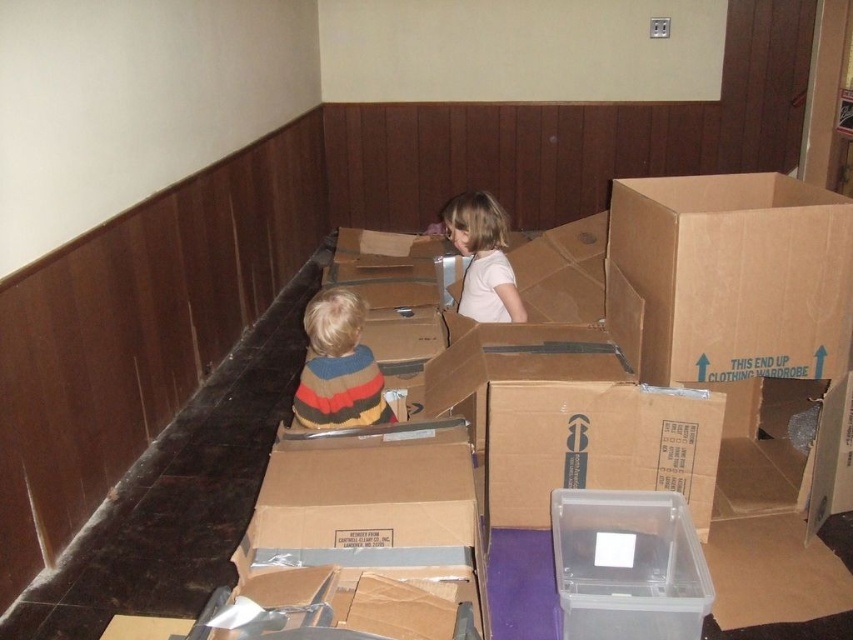
Does clear plastic container at center appear on the left side of white matte shirt at center?

No, clear plastic container at center is not to the left of white matte shirt at center.

Does clear plastic container at center have a lesser height compared to white matte shirt at center?

Yes.

This screenshot has height=640, width=853. Find the location of `clear plastic container at center`. clear plastic container at center is located at coordinates (627, 564).

At what (x,y) coordinates should I click in order to perform the action: click on clear plastic container at center. Please return your answer as a coordinate pair (x, y). This screenshot has width=853, height=640. Looking at the image, I should click on (627, 564).

Between clear plastic container at center and striped sweater at center, which one has less height?

With less height is clear plastic container at center.

Does clear plastic container at center have a greater height compared to striped sweater at center?

No.

Is point (701, 582) in front of point (326, 346)?

Yes, it is in front of point (326, 346).

Image resolution: width=853 pixels, height=640 pixels. Identify the location of clear plastic container at center. 627,564.

Consider the image. Does brown cardboard box at upper right have a greater height compared to striped sweater at center?

Correct, brown cardboard box at upper right is much taller as striped sweater at center.

This screenshot has width=853, height=640. I want to click on brown cardboard box at upper right, so click(735, 273).

Is point (733, 218) closer to viewer compared to point (349, 333)?

Yes, it is in front of point (349, 333).

Locate an element on the screen. This screenshot has width=853, height=640. brown cardboard box at upper right is located at coordinates (735, 273).